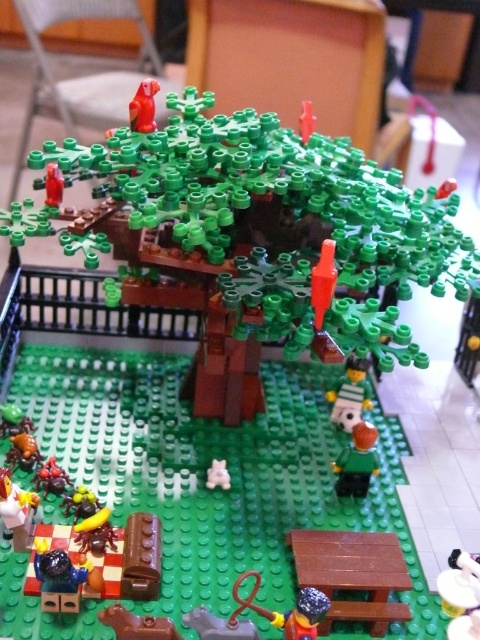
You are a small LEGO figure trying to reach the picnic table located near the rubberized brown boot at lower left. There is a smooth red figurine at upper left blocking your path. Can you go around it to reach the boot?

The smooth red figurine at upper left is located above the rubberized brown boot at lower left, so you can go around it to reach the boot since it is positioned higher up and not directly in your path.

You are a LEGO figure standing at the picnic table. You need to reach the smooth red figurine at upper left. Which direction should you go from the rubberized brown boot at lower left to get there?

The smooth red figurine at upper left is located above the rubberized brown boot at lower left. To reach it, you should move upward from the rubberized brown boot at lower left.